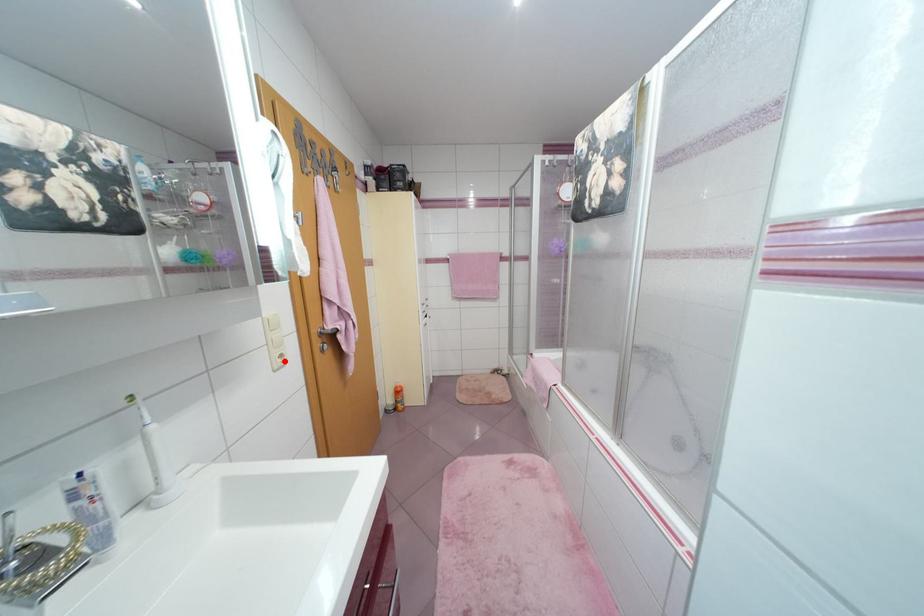
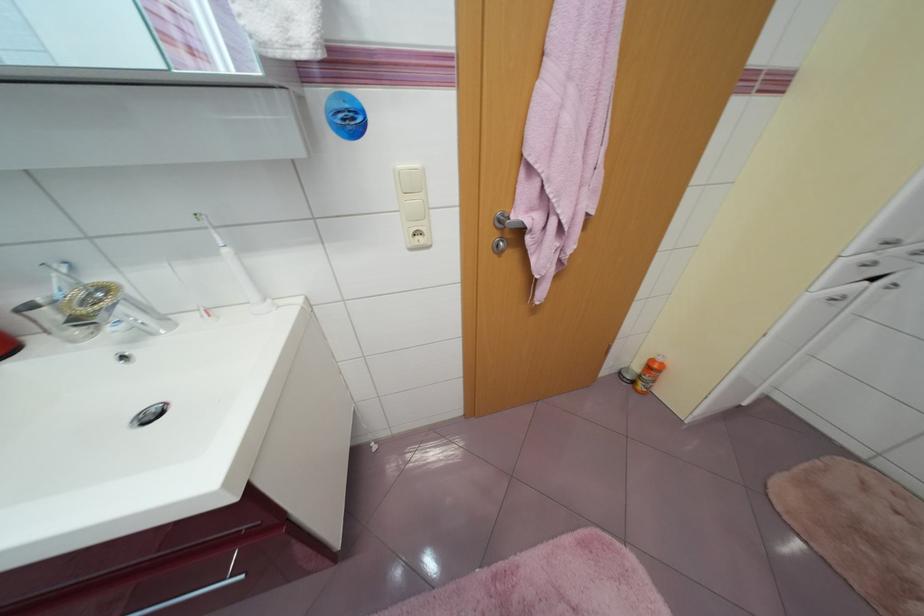
Where in the second image is the point corresponding to the highlighted location from the first image?

(423, 238)